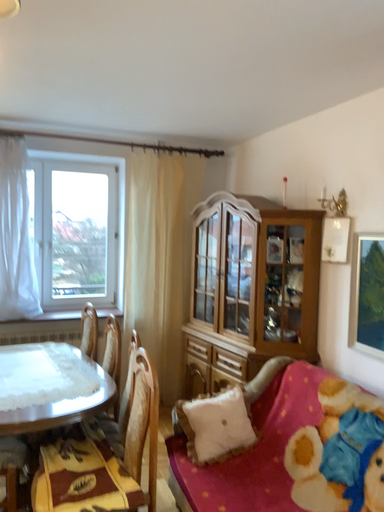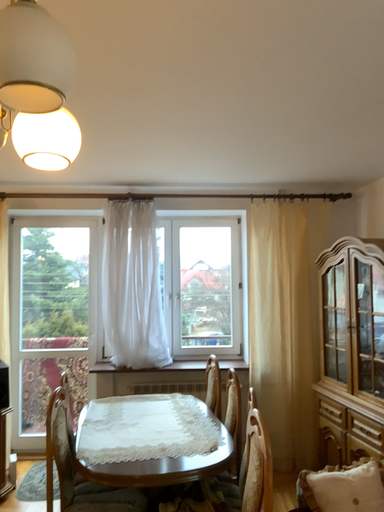
Question: Which way did the camera rotate in the video?

Choices:
 (A) rotated right
 (B) rotated left

Answer: (B)